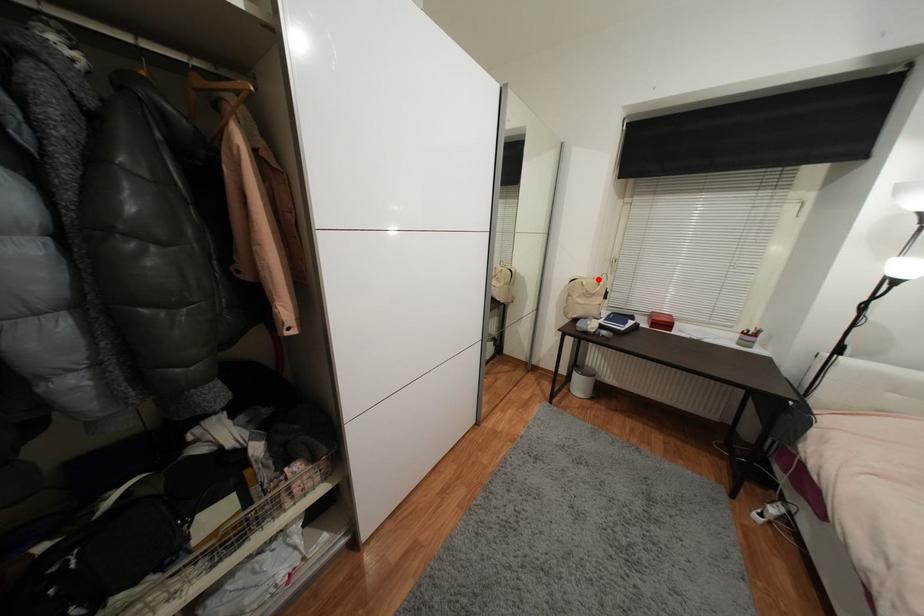
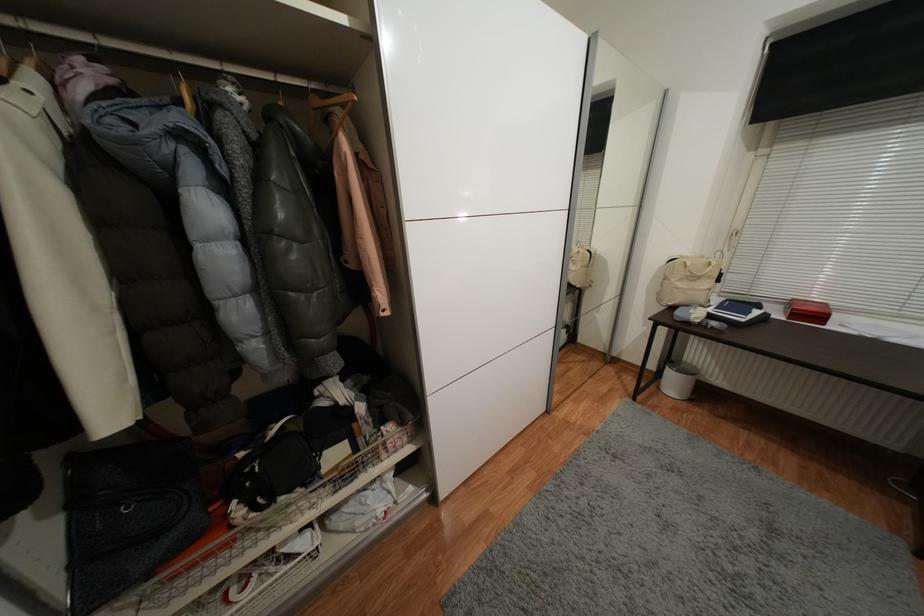
Question: I am providing you with two images of the same scene from different viewpoints. In image1, a red point is highlighted. Considering the same 3D point in image2, which of the following is correct?

Choices:
 (A) It is closer
 (B) It is farther

Answer: (B)